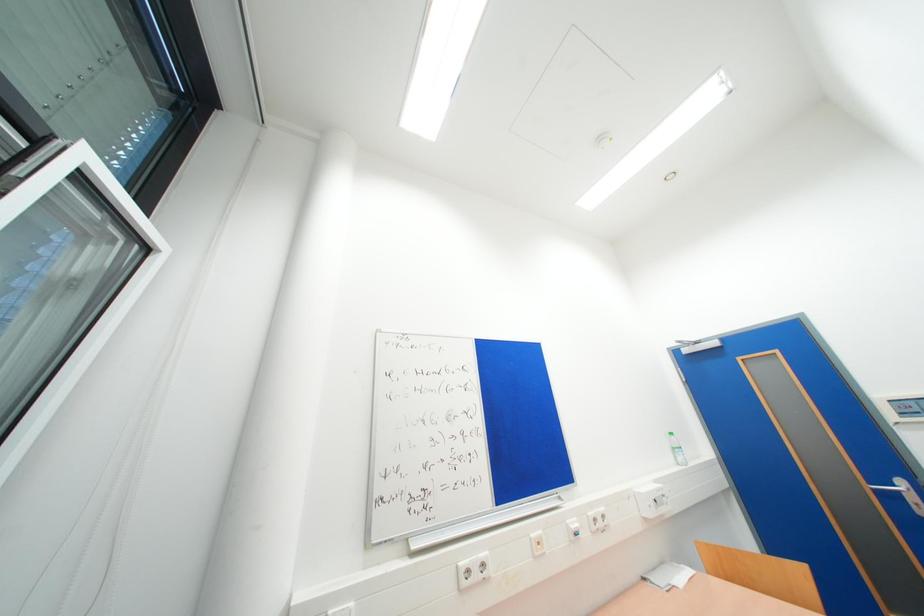
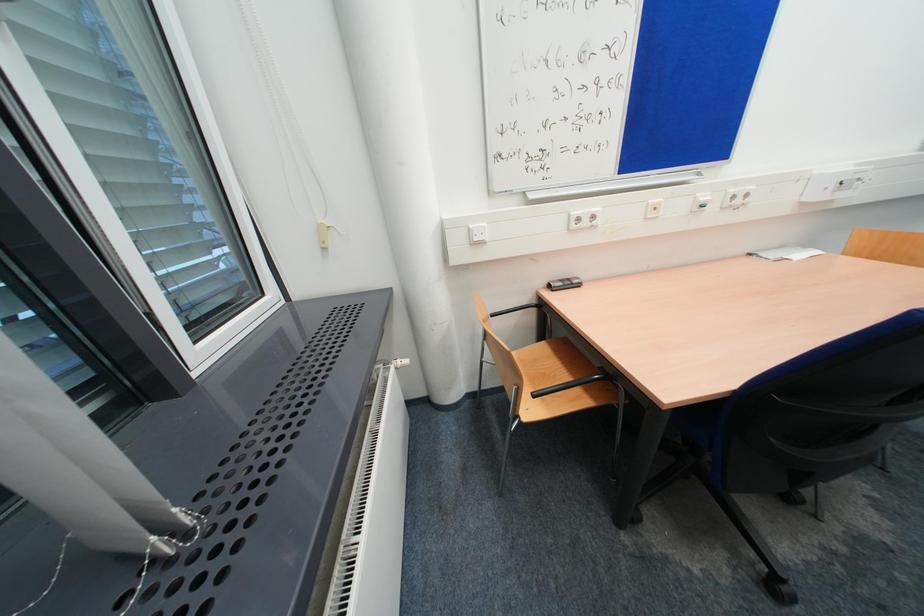
Based on the continuous images, in which direction is the camera rotating?

The camera rotated toward left-down.